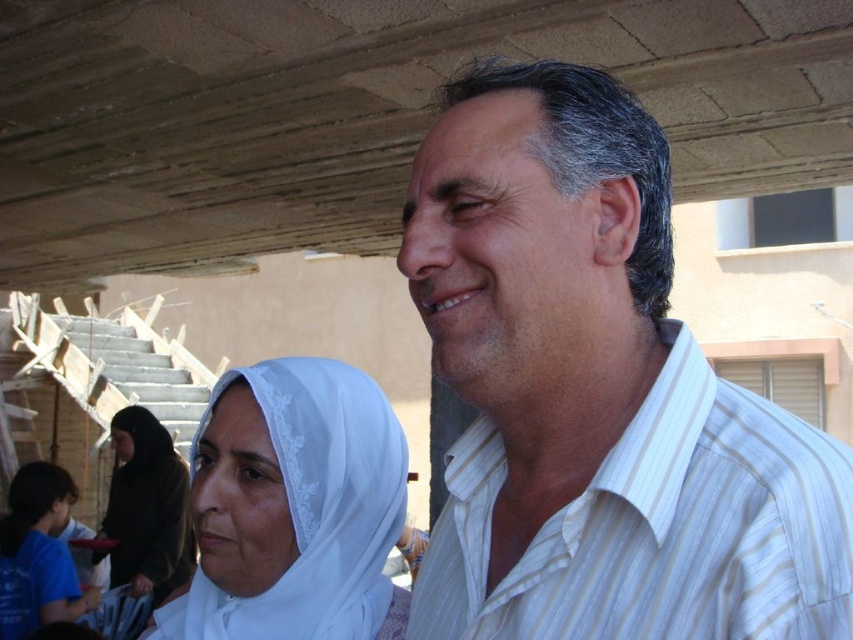
Question: Considering the real-world distances, which object is closest to the white lace headscarf at center?

Choices:
 (A) white lace hijab at lower left
 (B) white striped shirt at upper right

Answer: (B)

Question: Observing the image, what is the correct spatial positioning of white striped shirt at upper right in reference to white lace hijab at lower left?

Choices:
 (A) right
 (B) left

Answer: (A)

Question: Which object appears closest to the camera in this image?

Choices:
 (A) white lace headscarf at center
 (B) white striped shirt at upper right

Answer: (B)

Question: Considering the real-world distances, which object is farthest from the white striped shirt at upper right?

Choices:
 (A) white lace hijab at lower left
 (B) white lace headscarf at center

Answer: (A)

Question: Is white striped shirt at upper right closer to camera compared to white lace hijab at lower left?

Choices:
 (A) no
 (B) yes

Answer: (B)

Question: Is white striped shirt at upper right smaller than white lace hijab at lower left?

Choices:
 (A) no
 (B) yes

Answer: (B)